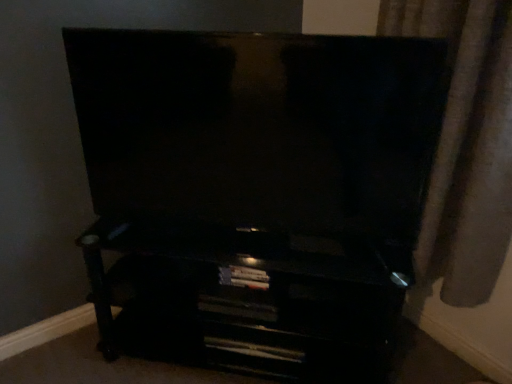
Question: Which is correct: matte black tv at center is inside satin beige curtain at right, or outside of it?

Choices:
 (A) outside
 (B) inside

Answer: (A)

Question: Is matte black tv at center in front of or behind satin beige curtain at right in the image?

Choices:
 (A) behind
 (B) front

Answer: (A)

Question: Estimate the real-world distances between objects in this image. Which object is closer to the matte black tv at center?

Choices:
 (A) satin beige curtain at right
 (B) black glossy entertainment center at lower center

Answer: (B)

Question: Which is nearer to the satin beige curtain at right?

Choices:
 (A) matte black tv at center
 (B) black glossy entertainment center at lower center

Answer: (A)